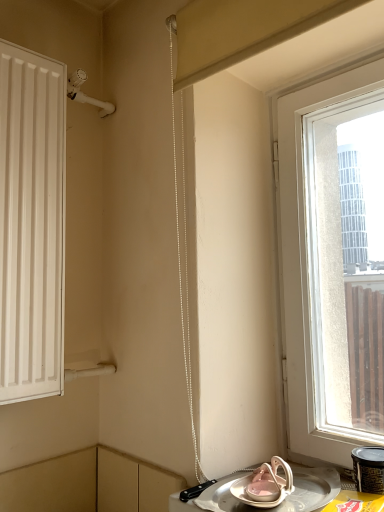
Question: Does transparent glass window at right contain black plastic container at lower right?

Choices:
 (A) no
 (B) yes

Answer: (A)

Question: Would you say transparent glass window at right is a long distance from black plastic container at lower right?

Choices:
 (A) no
 (B) yes

Answer: (A)

Question: From the image's perspective, would you say transparent glass window at right is positioned over black plastic container at lower right?

Choices:
 (A) yes
 (B) no

Answer: (A)

Question: Can you confirm if transparent glass window at right is thinner than black plastic container at lower right?

Choices:
 (A) yes
 (B) no

Answer: (B)

Question: Is the position of transparent glass window at right more distant than that of black plastic container at lower right?

Choices:
 (A) yes
 (B) no

Answer: (A)

Question: From the image's perspective, is metallic silver tray at lower right located above or below transparent glass window at right?

Choices:
 (A) above
 (B) below

Answer: (B)

Question: Is metallic silver tray at lower right in front of or behind transparent glass window at right in the image?

Choices:
 (A) behind
 (B) front

Answer: (B)

Question: Looking at the image, does metallic silver tray at lower right seem bigger or smaller compared to transparent glass window at right?

Choices:
 (A) big
 (B) small

Answer: (B)

Question: Is metallic silver tray at lower right inside the boundaries of transparent glass window at right, or outside?

Choices:
 (A) inside
 (B) outside

Answer: (B)

Question: In the image, is metallic silver tray at lower right on the left side or the right side of black plastic container at lower right?

Choices:
 (A) right
 (B) left

Answer: (B)

Question: From the image's perspective, relative to black plastic container at lower right, is metallic silver tray at lower right above or below?

Choices:
 (A) below
 (B) above

Answer: (A)

Question: From a real-world perspective, is metallic silver tray at lower right physically located above or below black plastic container at lower right?

Choices:
 (A) below
 (B) above

Answer: (A)

Question: Is metallic silver tray at lower right wider or thinner than black plastic container at lower right?

Choices:
 (A) thin
 (B) wide

Answer: (B)

Question: Is point [x=377, y=448] positioned closer to the camera than point [x=228, y=476]?

Choices:
 (A) closer
 (B) farther

Answer: (A)

Question: Looking at their shapes, would you say black plastic container at lower right is wider or thinner than metallic silver tray at lower right?

Choices:
 (A) wide
 (B) thin

Answer: (B)